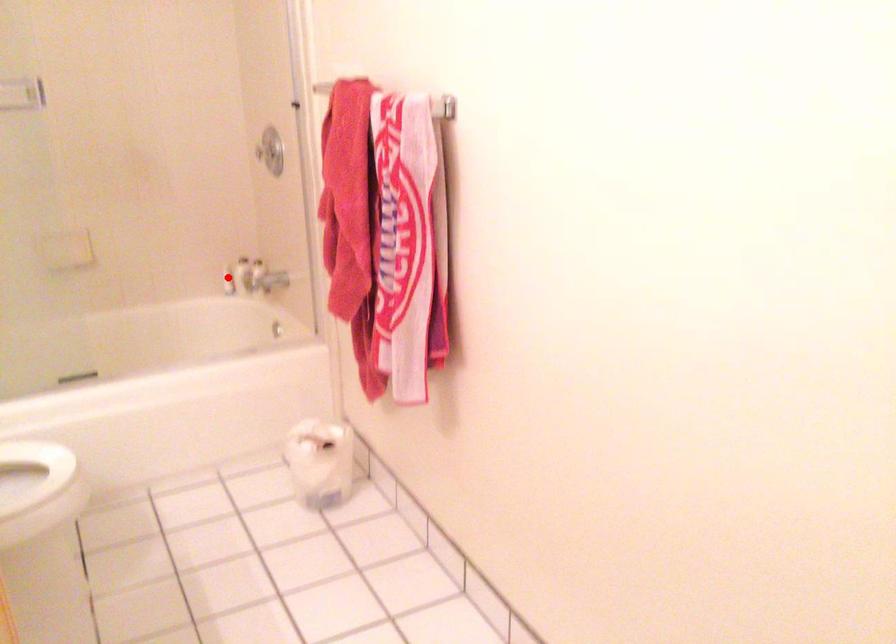
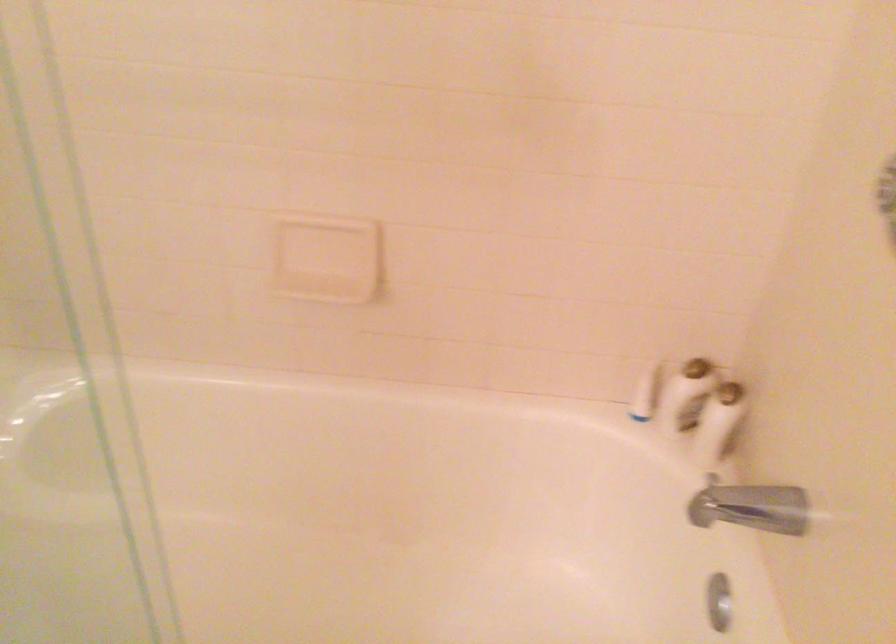
Find the pixel in the second image that matches the highlighted location in the first image.

(644, 393)